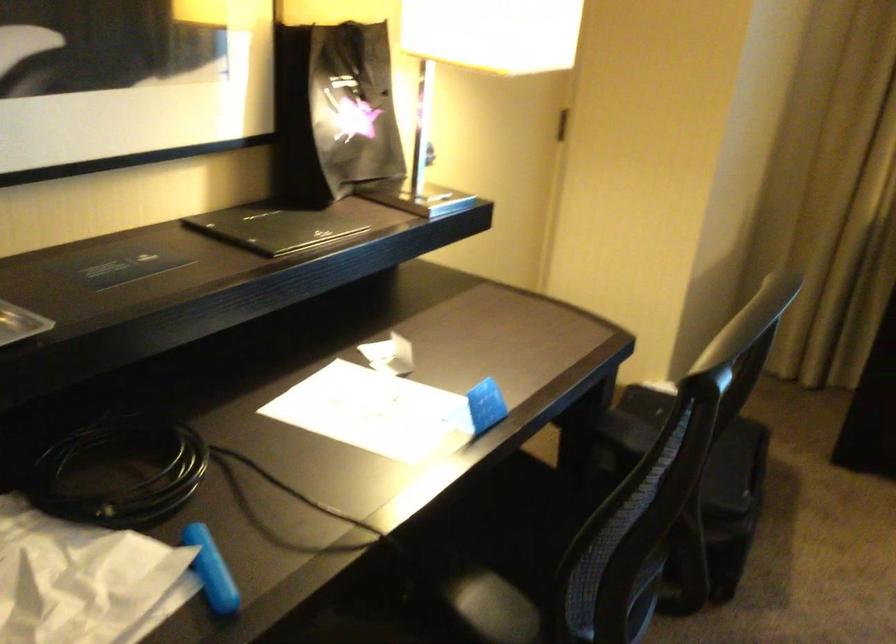
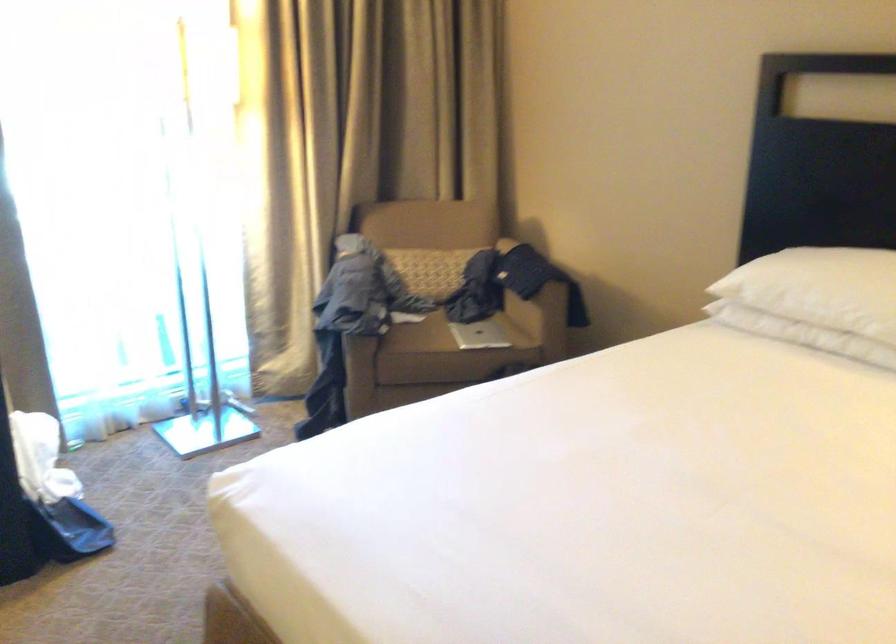
Question: The camera is either moving clockwise (left) or counter-clockwise (right) around the object. The first image is from the beginning of the video and the second image is from the end. Is the camera moving left or right when shooting the video?

Choices:
 (A) Left
 (B) Right

Answer: (A)